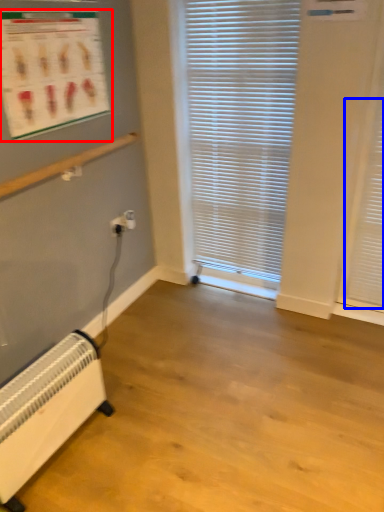
Question: Among these objects, which one is farthest to the camera, bulletin board (highlighted by a red box) or shutter (highlighted by a blue box)?

Choices:
 (A) bulletin board
 (B) shutter

Answer: (B)